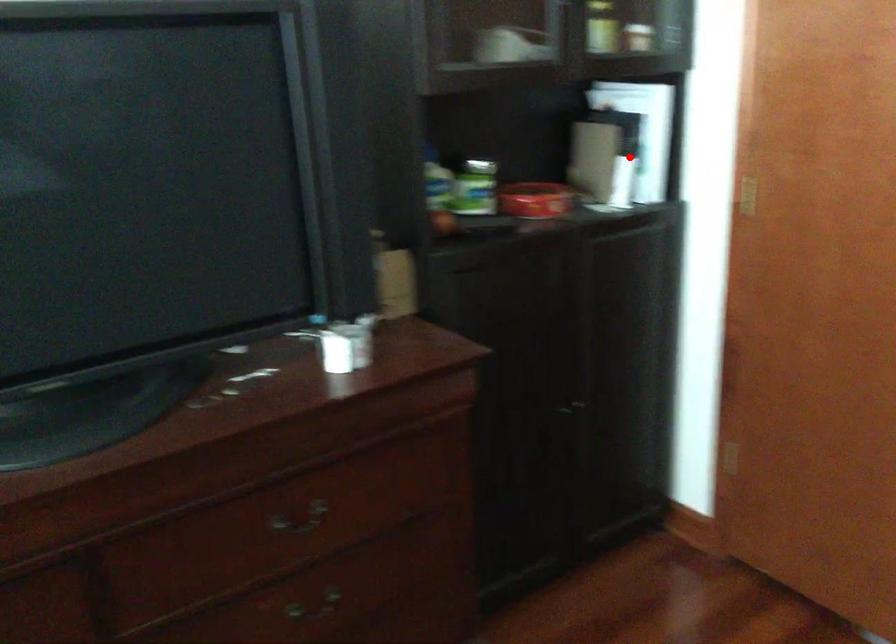
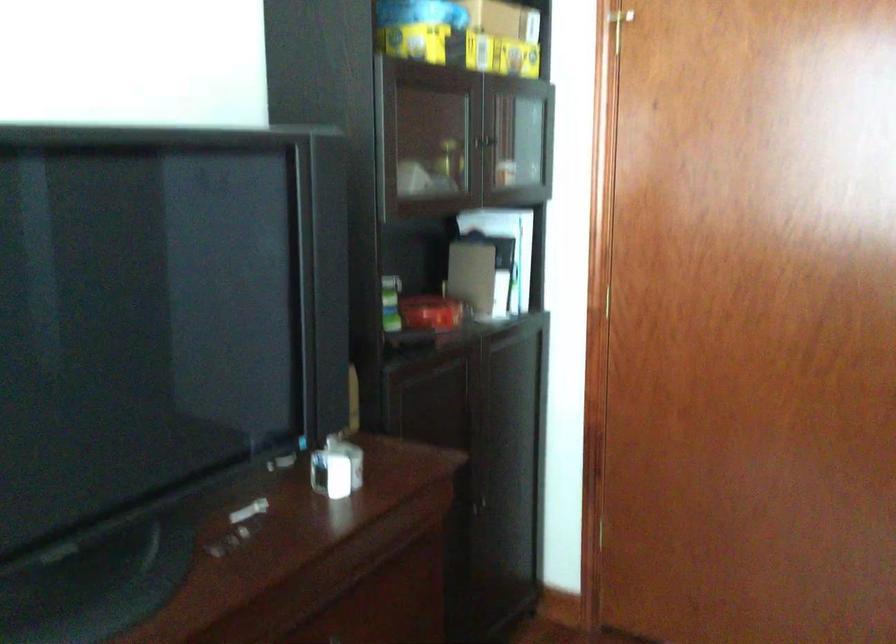
Question: A red point is marked in image1. In image2, is the corresponding 3D point closer to the camera or farther? Reply with the corresponding letter.

Choices:
 (A) The corresponding 3D point is closer.
 (B) The corresponding 3D point is farther.

Answer: (B)